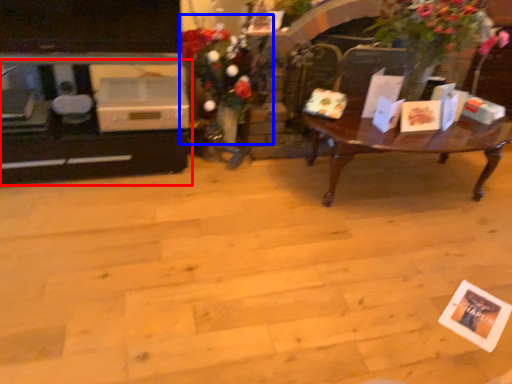
Question: Which object is further to the camera taking this photo, entertainment center (highlighted by a red box) or floral arrangement (highlighted by a blue box)?

Choices:
 (A) entertainment center
 (B) floral arrangement

Answer: (A)